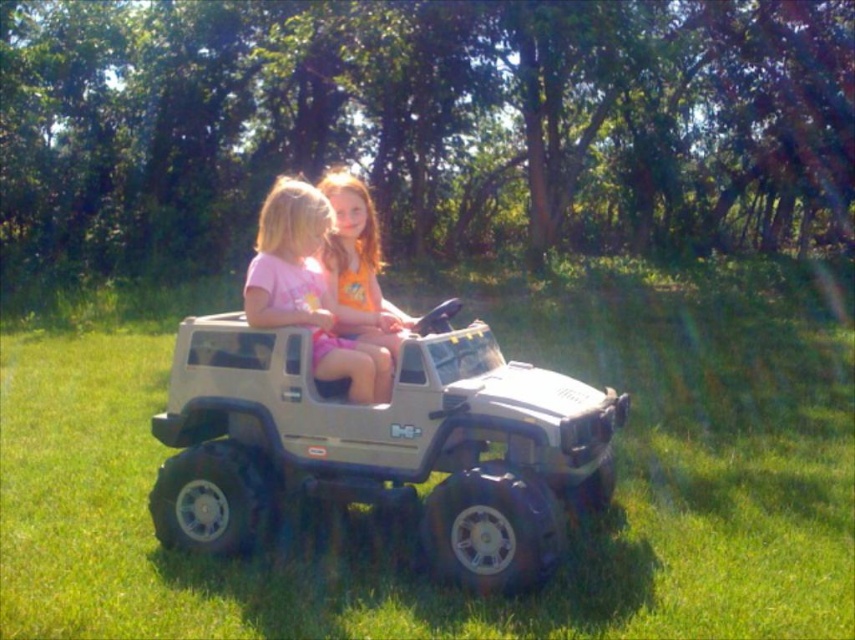
You are a parent trying to decide which shirt to take for a picnic. You see the matte pink shirt at center and the orange cotton shirt at center in the image. Based on their thickness, which one would be more comfortable in hot weather?

The matte pink shirt at center is thinner than the orange cotton shirt at center, so it would be more comfortable in hot weather because thinner fabrics allow better airflow and cooling.

You are a drone operator trying to capture a photo of the toy Jeep with the children. The camera is currently positioned above the green grass at center. To frame the Jeep and children properly, you need to adjust the camera to the left or right. Based on the coordinates provided, should you move the camera to the left or right to center the Jeep?

The green grass at center is located at coordinates point (401, 536). Since the Jeep is the primary subject and the camera is above the green grass at center, moving the camera to the left would align it with the Jeep as the grass is positioned to the right of the ideal center point.

You are standing in front of the toy Jeep with the two children. There are two points marked on the Jeep. One is at coordinate point (575, 632) and the other is at point (563, 429). Which point is closer to you?

Point (575, 632) is closer to the viewer than point (563, 429).